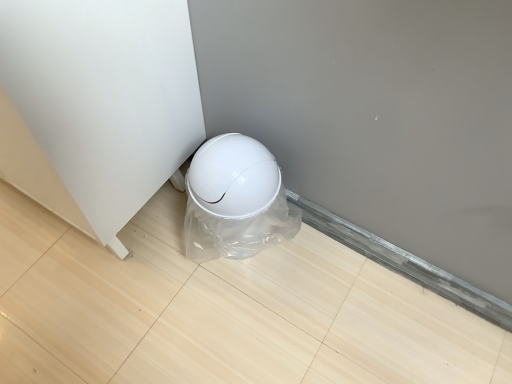
Where is `white glossy waste container at lower left`? The height and width of the screenshot is (384, 512). white glossy waste container at lower left is located at coordinates (234, 200).

What do you see at coordinates (234, 200) in the screenshot? This screenshot has height=384, width=512. I see `white glossy waste container at lower left` at bounding box center [234, 200].

Locate an element on the screen. This screenshot has height=384, width=512. white glossy waste container at lower left is located at coordinates (234, 200).